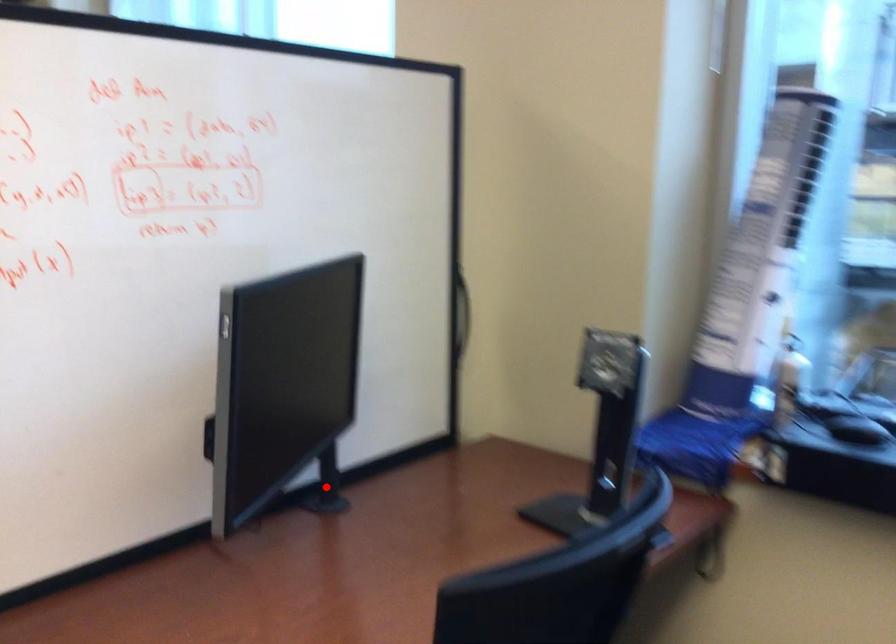
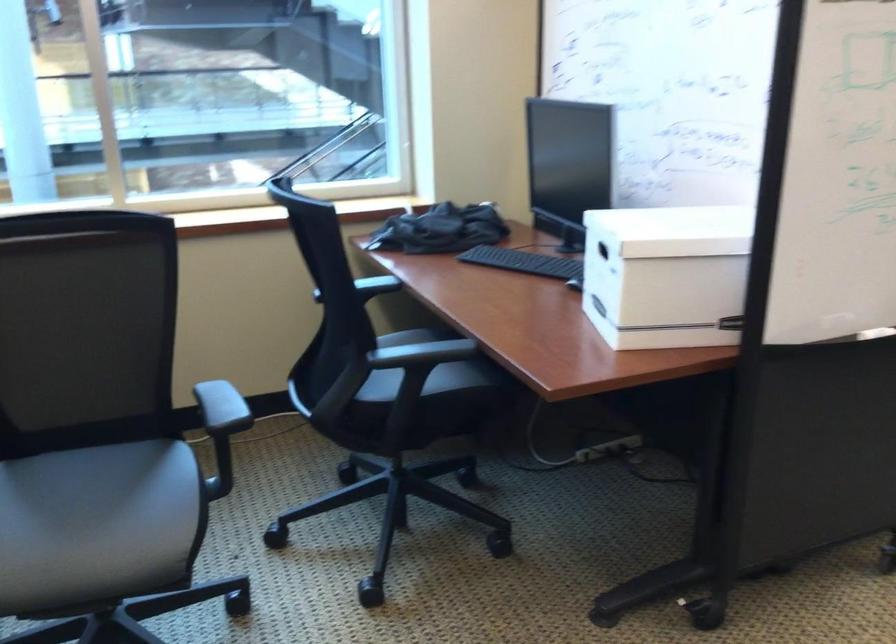
Question: I am providing you with two images of the same scene from different viewpoints. A red point is marked on the first image. At the location where the point appears in image 1, is it still visible in image 2?

Choices:
 (A) Yes
 (B) No

Answer: (B)